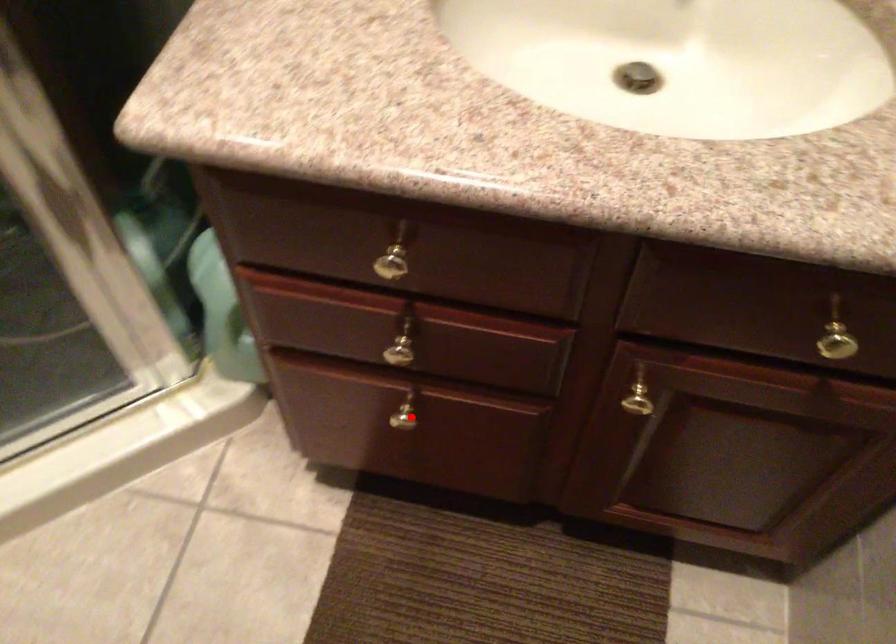
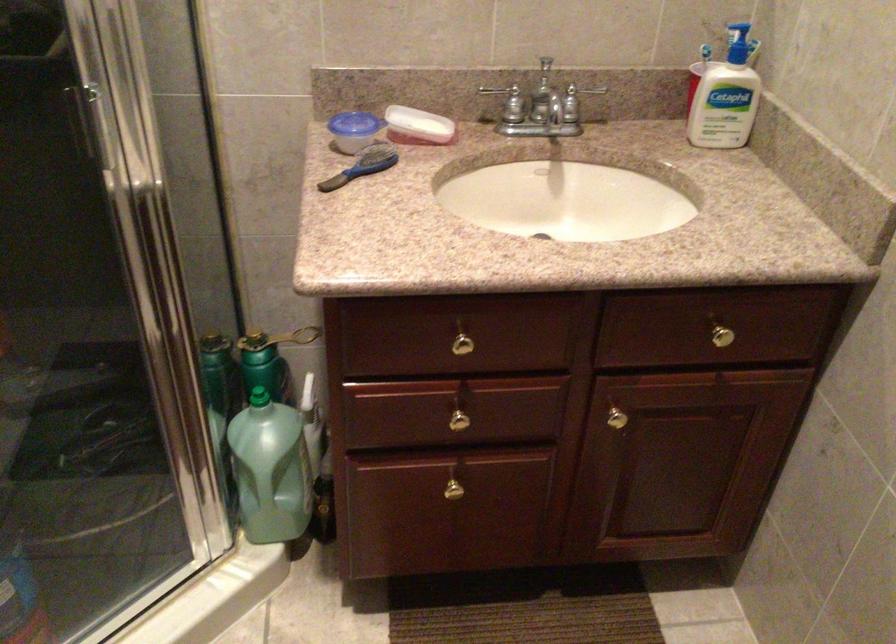
The point at the highlighted location is marked in the first image. Where is the corresponding point in the second image?

(455, 488)